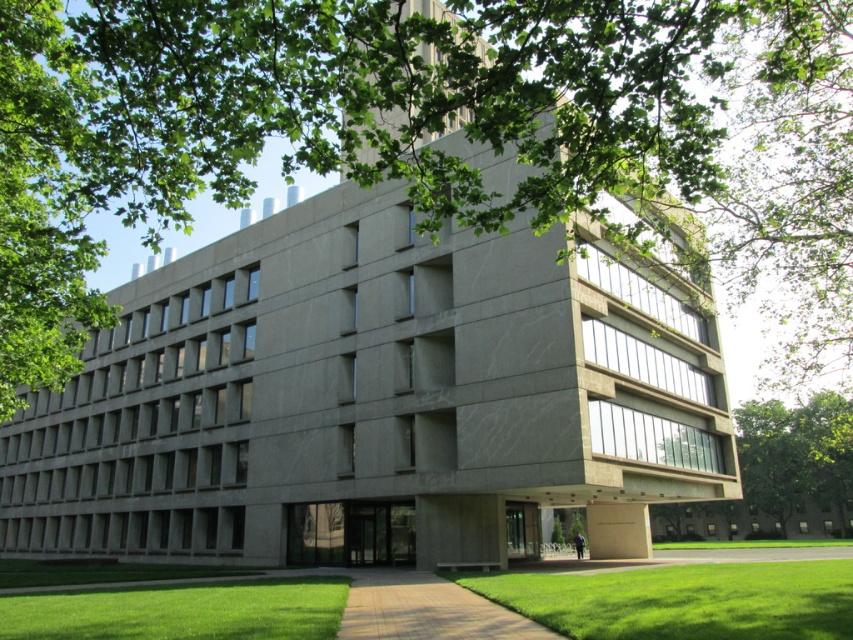
Who is positioned more to the left, green leafy tree at lower right or brick paved path at center?

From the viewer's perspective, brick paved path at center appears more on the left side.

Measure the distance between green leafy tree at lower right and brick paved path at center.

169.49 feet

Does point (836, 428) lie behind point (410, 605)?

That is True.

You are a GUI agent. You are given a task and a screenshot of the screen. Output one action in this format:
    pyautogui.click(x=<x>, y=<y>)
    Task: Click on the green leafy tree at lower right
    This screenshot has height=640, width=853.
    Given the screenshot: What is the action you would take?
    pyautogui.click(x=795, y=454)

Does point (334, 636) lie in front of point (447, 604)?

That is True.

Looking at this image, is green grass at lower left smaller than brick paved path at center?

No, green grass at lower left is not smaller than brick paved path at center.

Describe the element at coordinates (183, 611) in the screenshot. I see `green grass at lower left` at that location.

The image size is (853, 640). Identify the location of green grass at lower left. tap(183, 611).

What do you see at coordinates (682, 600) in the screenshot?
I see `green grass at lower center` at bounding box center [682, 600].

Does green grass at lower center have a lesser width compared to green leafy tree at lower right?

Yes.

Which is in front, point (706, 634) or point (776, 500)?

Point (706, 634)

At what (x,y) coordinates should I click in order to perform the action: click on green grass at lower center. Please return your answer as a coordinate pair (x, y). Looking at the image, I should click on (682, 600).